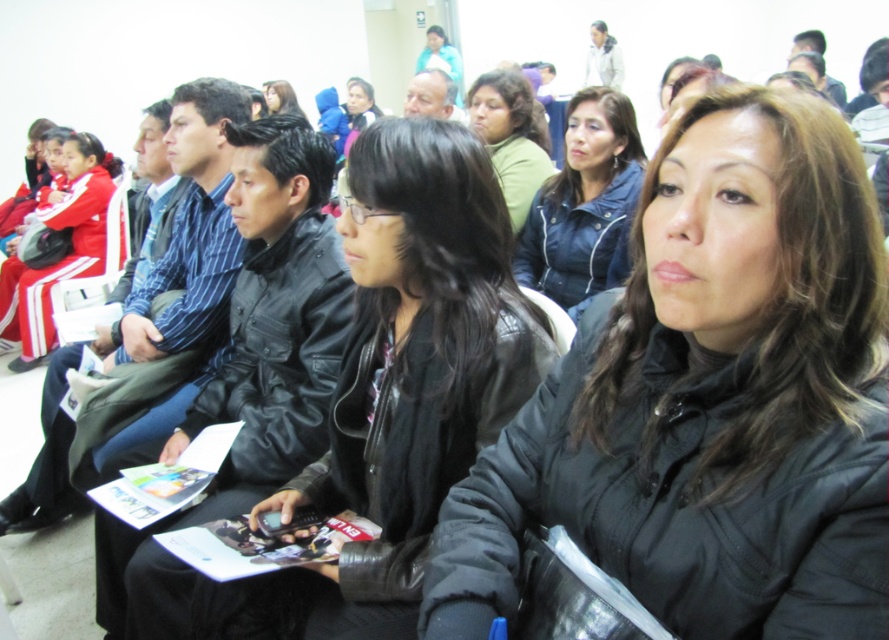
Question: Which object is positioned farthest from the black matte jacket at center?

Choices:
 (A) blue denim jacket at center
 (B) matte black jacket at center
 (C) matte black hair at center
 (D) green matte shirt at center

Answer: (B)

Question: Which point is farther from the camera taking this photo?

Choices:
 (A) (271, 88)
 (B) (519, 74)
 (C) (422, 291)
 (D) (587, 129)

Answer: (A)

Question: Does black leather jacket at center appear over matte black jacket at center?

Choices:
 (A) no
 (B) yes

Answer: (A)

Question: Can you confirm if blue denim jacket at center is positioned above red matte tracksuit at left?

Choices:
 (A) yes
 (B) no

Answer: (B)

Question: Which object is farther from the camera taking this photo?

Choices:
 (A) black matte jacket at center
 (B) matte black jacket at center
 (C) red matte tracksuit at left

Answer: (B)

Question: Does green matte shirt at center have a greater width compared to matte black hair at center?

Choices:
 (A) no
 (B) yes

Answer: (B)